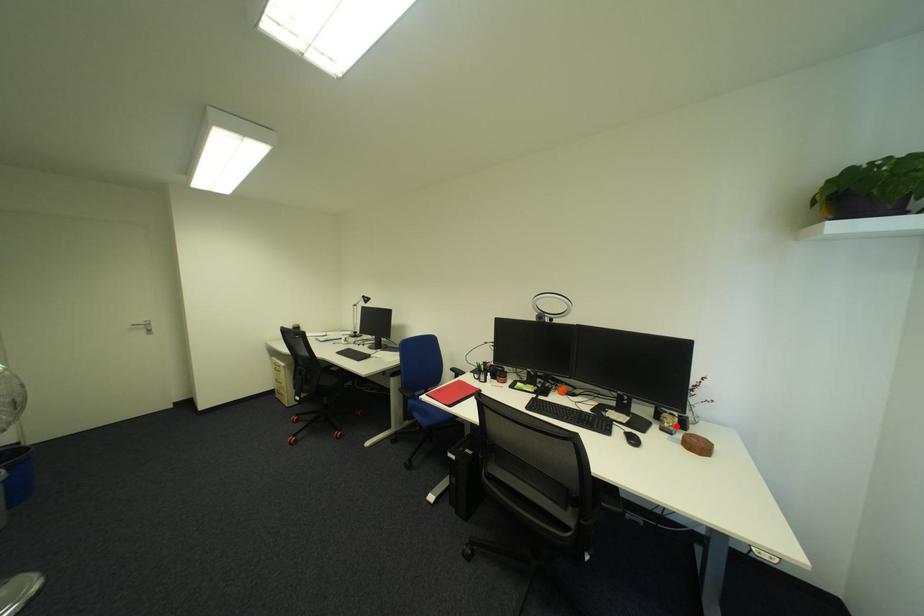
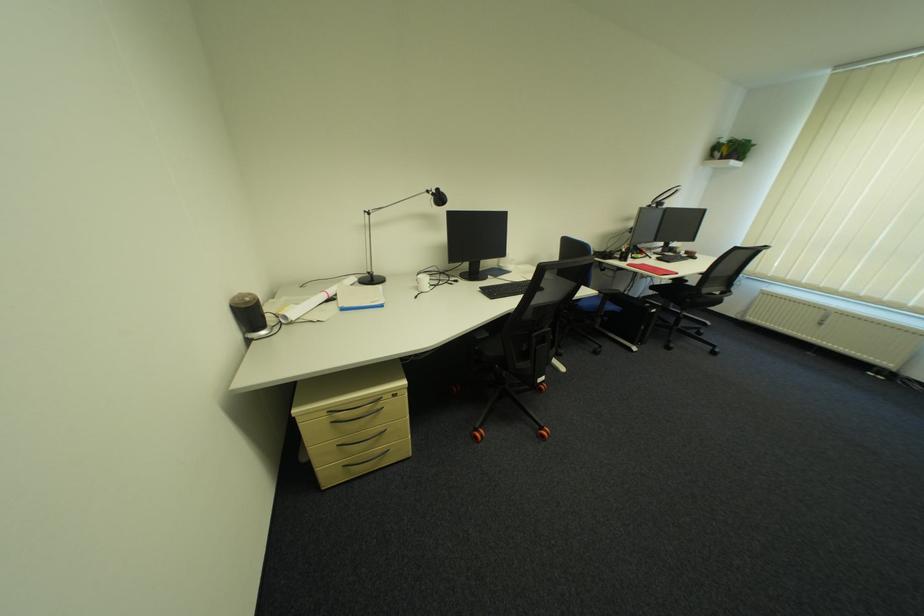
In the second image, find the point that corresponds to the highlighted location in the first image.

(687, 252)